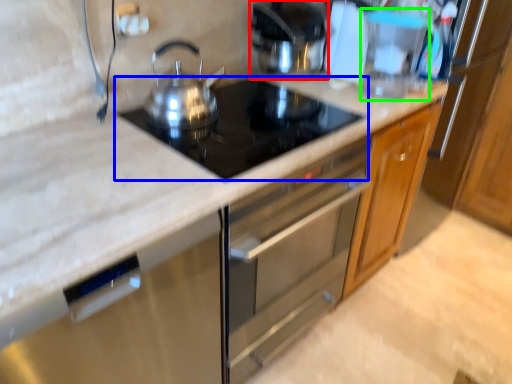
Question: Which object is the farthest from kitchen appliance (highlighted by a red box)? Choose among these: gas stove (highlighted by a blue box) or appliance (highlighted by a green box).

Choices:
 (A) gas stove
 (B) appliance

Answer: (A)